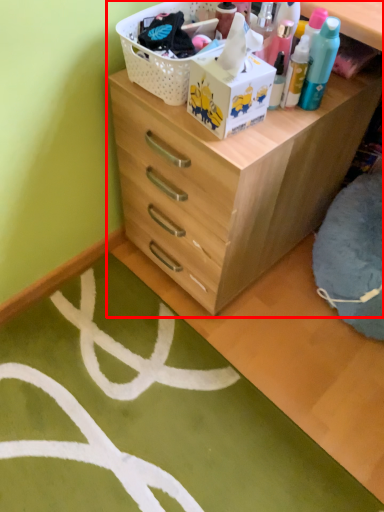
Question: From the image's perspective, considering the relative positions of chest of drawers (annotated by the red box) and basket in the image provided, where is chest of drawers (annotated by the red box) located with respect to the staircase?

Choices:
 (A) below
 (B) above

Answer: (A)